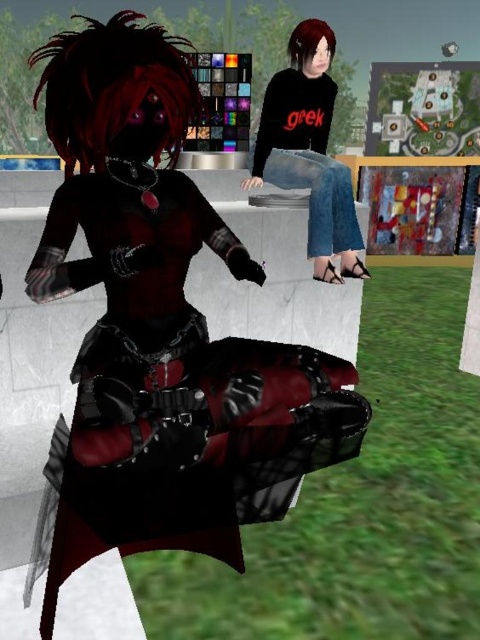
Can you confirm if matte black armor at center is taller than denim jeans at center?

Yes, matte black armor at center is taller than denim jeans at center.

Measure the distance from matte black armor at center to denim jeans at center.

matte black armor at center and denim jeans at center are 1.03 meters apart.

Where is `matte black armor at center`? Image resolution: width=480 pixels, height=640 pixels. matte black armor at center is located at coordinates (160, 324).

Locate an element on the screen. matte black armor at center is located at coordinates (160, 324).